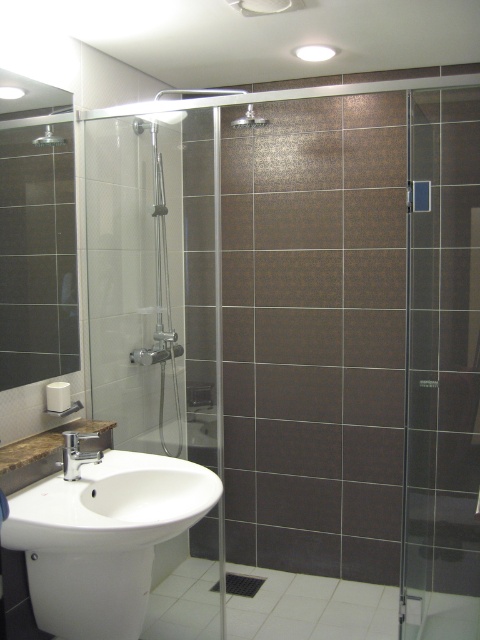
Is transparent glass shower door at center taller than matte silver showerhead at upper center?

→ Yes.

What do you see at coordinates (156, 280) in the screenshot?
I see `transparent glass shower door at center` at bounding box center [156, 280].

You are a GUI agent. You are given a task and a screenshot of the screen. Output one action in this format:
    pyautogui.click(x=<x>, y=<y>)
    Task: Click on the transparent glass shower door at center
    
    Given the screenshot: What is the action you would take?
    pyautogui.click(x=156, y=280)

Find the location of a particular element. This screenshot has width=480, height=640. transparent glass shower door at center is located at coordinates (156, 280).

Between point (450, 584) and point (95, 435), which one is positioned behind?

The point (450, 584) is more distant.

Is point (451, 557) less distant than point (97, 461)?

That is False.

Describe the element at coordinates (442, 369) in the screenshot. Image resolution: width=480 pixels, height=640 pixels. I see `transparent glass door at right` at that location.

Identify the location of transparent glass door at right. (442, 369).

Is point (75, 625) positioned in front of point (54, 141)?

Yes, it is in front of point (54, 141).

Does white glossy toilet bowl at lower left have a lesser height compared to matte silver shower head at upper left?

No, white glossy toilet bowl at lower left is not shorter than matte silver shower head at upper left.

Image resolution: width=480 pixels, height=640 pixels. What do you see at coordinates (90, 593) in the screenshot?
I see `white glossy toilet bowl at lower left` at bounding box center [90, 593].

Locate an element on the screen. The image size is (480, 640). white glossy toilet bowl at lower left is located at coordinates (90, 593).